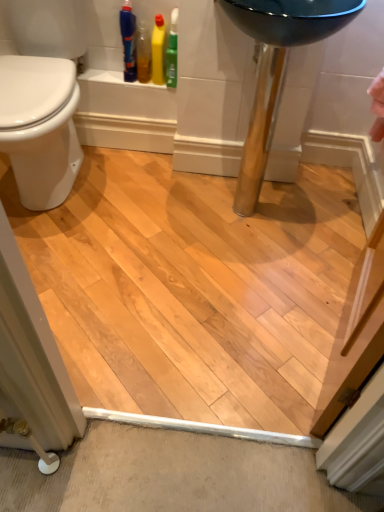
Question: Can translucent plastic bottle at upper left, positioned as the second cleaning product in right-to-left order, be found inside blue plastic bottle at upper left?

Choices:
 (A) yes
 (B) no

Answer: (B)

Question: Is blue plastic bottle at upper left smaller than translucent plastic bottle at upper left, the first cleaning product when ordered from left to right?

Choices:
 (A) no
 (B) yes

Answer: (A)

Question: From the image's perspective, is blue plastic bottle at upper left above translucent plastic bottle at upper left, the first cleaning product when ordered from left to right?

Choices:
 (A) yes
 (B) no

Answer: (A)

Question: From a real-world perspective, does blue plastic bottle at upper left stand above translucent plastic bottle at upper left, the first cleaning product when ordered from left to right?

Choices:
 (A) no
 (B) yes

Answer: (B)

Question: Is blue plastic bottle at upper left thinner than translucent plastic bottle at upper left, the first cleaning product when ordered from left to right?

Choices:
 (A) no
 (B) yes

Answer: (A)

Question: Considering the relative positions of blue plastic bottle at upper left and translucent plastic bottle at upper left, the first cleaning product when ordered from left to right, in the image provided, is blue plastic bottle at upper left to the right of translucent plastic bottle at upper left, the first cleaning product when ordered from left to right, from the viewer's perspective?

Choices:
 (A) no
 (B) yes

Answer: (A)

Question: Does translucent plastic bottle at upper left, positioned as the second cleaning product in right-to-left order, have a greater width compared to white glossy bidet at left?

Choices:
 (A) yes
 (B) no

Answer: (B)

Question: Is translucent plastic bottle at upper left, positioned as the second cleaning product in right-to-left order, facing away from white glossy bidet at left?

Choices:
 (A) no
 (B) yes

Answer: (A)

Question: Is translucent plastic bottle at upper left, positioned as the second cleaning product in right-to-left order, further to the viewer compared to white glossy bidet at left?

Choices:
 (A) no
 (B) yes

Answer: (B)

Question: Is white glossy bidet at left located within translucent plastic bottle at upper left, the first cleaning product when ordered from left to right?

Choices:
 (A) no
 (B) yes

Answer: (A)

Question: From the image's perspective, is translucent plastic bottle at upper left, the first cleaning product when ordered from left to right, located beneath white glossy bidet at left?

Choices:
 (A) no
 (B) yes

Answer: (A)

Question: Considering the relative sizes of translucent plastic bottle at upper left, positioned as the second cleaning product in right-to-left order, and white glossy bidet at left in the image provided, is translucent plastic bottle at upper left, positioned as the second cleaning product in right-to-left order, taller than white glossy bidet at left?

Choices:
 (A) yes
 (B) no

Answer: (B)

Question: Can you confirm if yellow glossy bottle at upper left, placed as the 2th cleaning product when sorted from left to right, is smaller than blue plastic bottle at upper left?

Choices:
 (A) no
 (B) yes

Answer: (B)